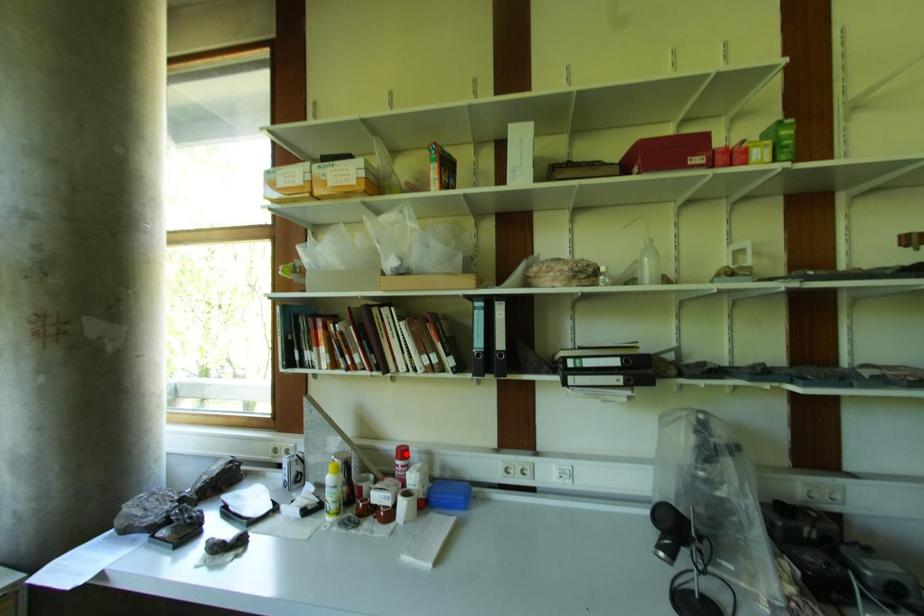
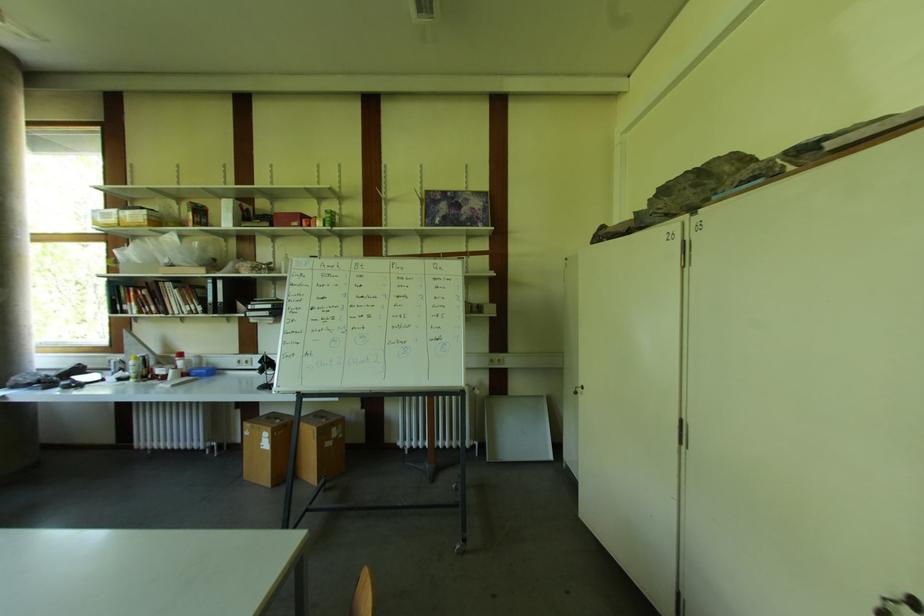
Locate, in the second image, the point that corresponds to the highlighted location in the first image.

(184, 357)